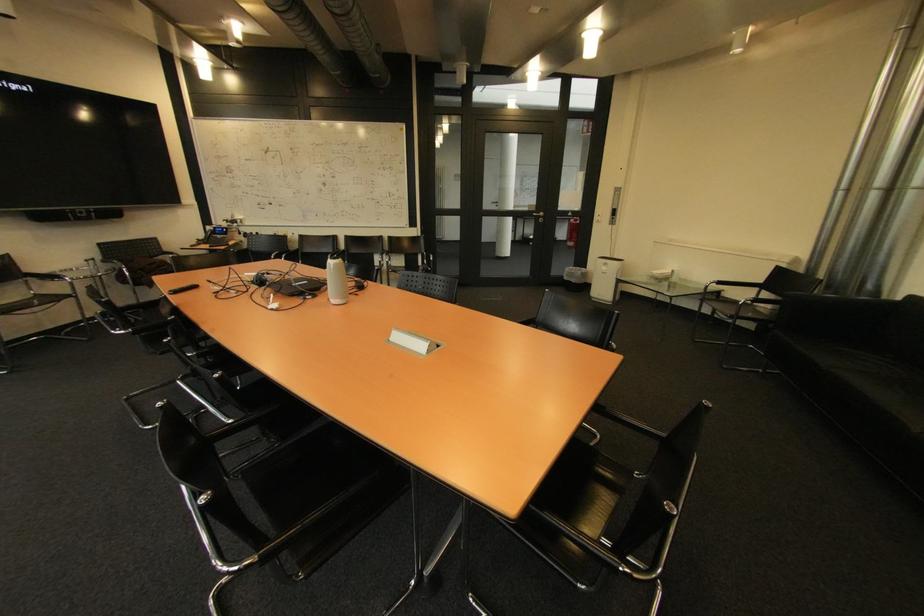
Describe the element at coordinates (830, 312) in the screenshot. I see `a sofa armrest` at that location.